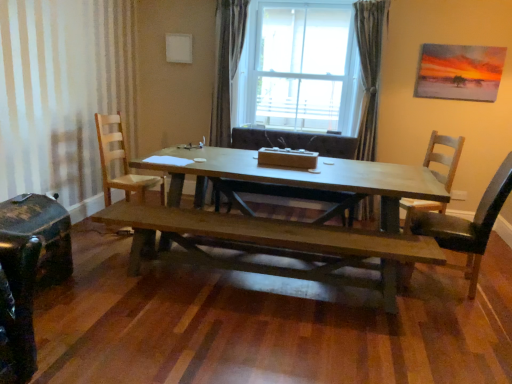
Find the location of a particular element. The height and width of the screenshot is (384, 512). vacant space in dark brown wooden bench at center (from a real-world perspective) is located at coordinates (234, 278).